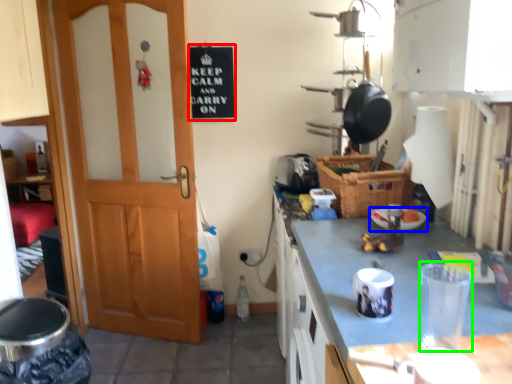
Question: Which object is positioned farthest from bulletin board (highlighted by a red box)? Select from appliance (highlighted by a blue box) and appliance (highlighted by a green box).

Choices:
 (A) appliance
 (B) appliance

Answer: (B)